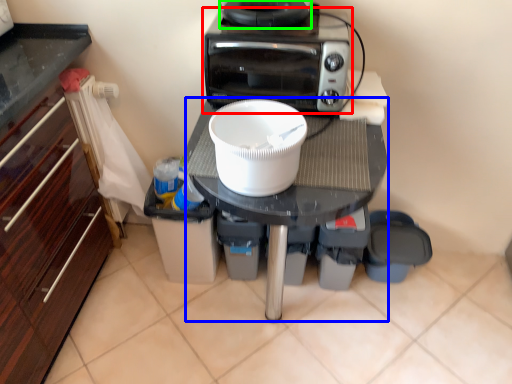
Question: Which object is the farthest from home appliance (highlighted by a red box)? Choose among these: table (highlighted by a blue box) or appliance (highlighted by a green box).

Choices:
 (A) table
 (B) appliance

Answer: (A)